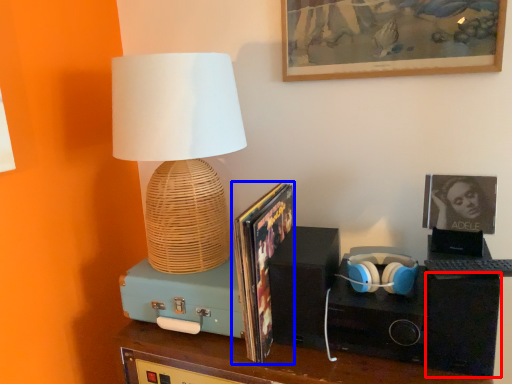
Question: Which point is closer to the camera, speaker (highlighted by a red box) or magazine (highlighted by a blue box)?

Choices:
 (A) speaker
 (B) magazine

Answer: (A)